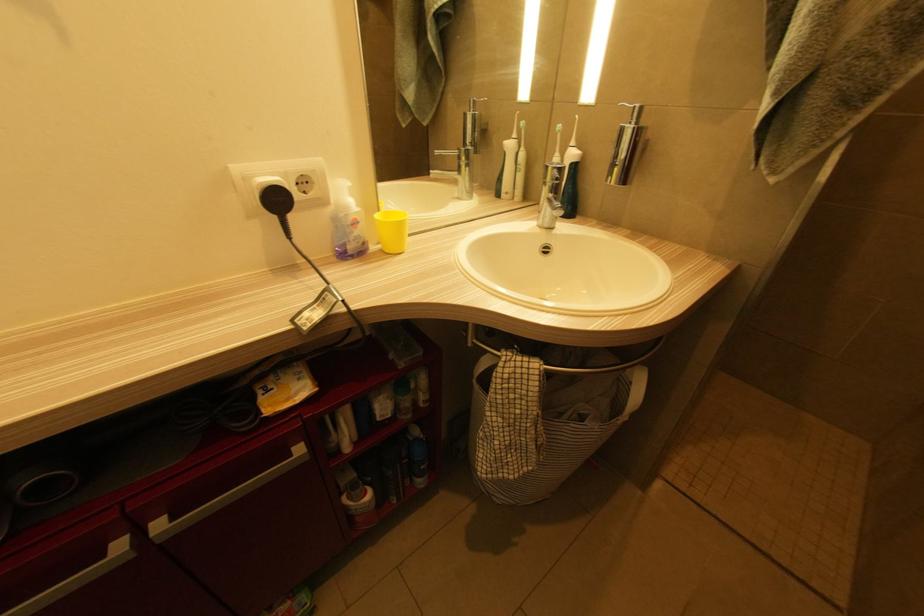
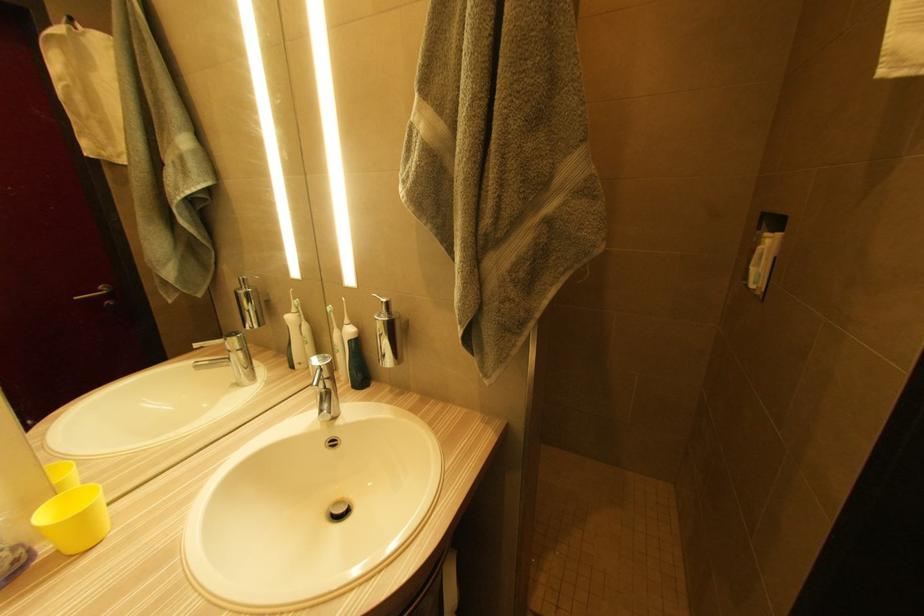
Question: The camera is either moving clockwise (left) or counter-clockwise (right) around the object. The first image is from the beginning of the video and the second image is from the end. Is the camera moving left or right when shooting the video?

Choices:
 (A) Left
 (B) Right

Answer: (A)